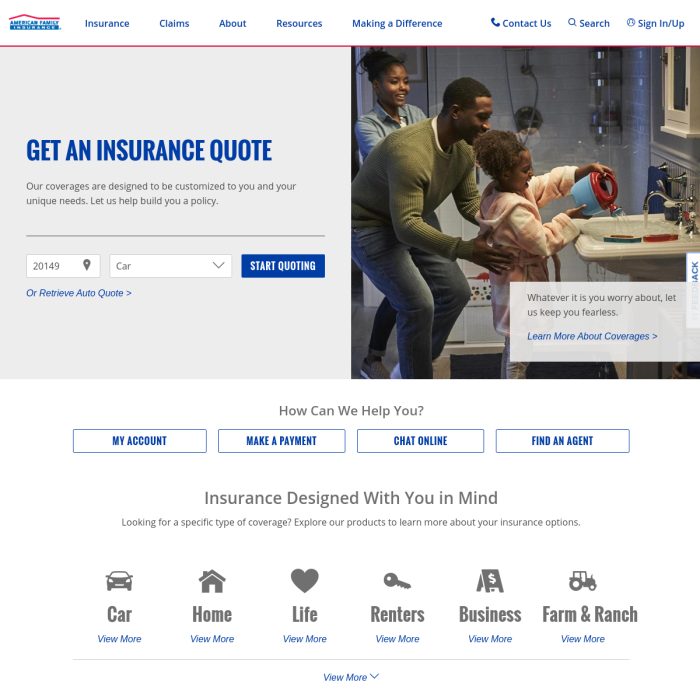
This screenshot has width=700, height=700. What are the coordinates of `medicine cabinet` in the screenshot? It's located at (x=678, y=78).